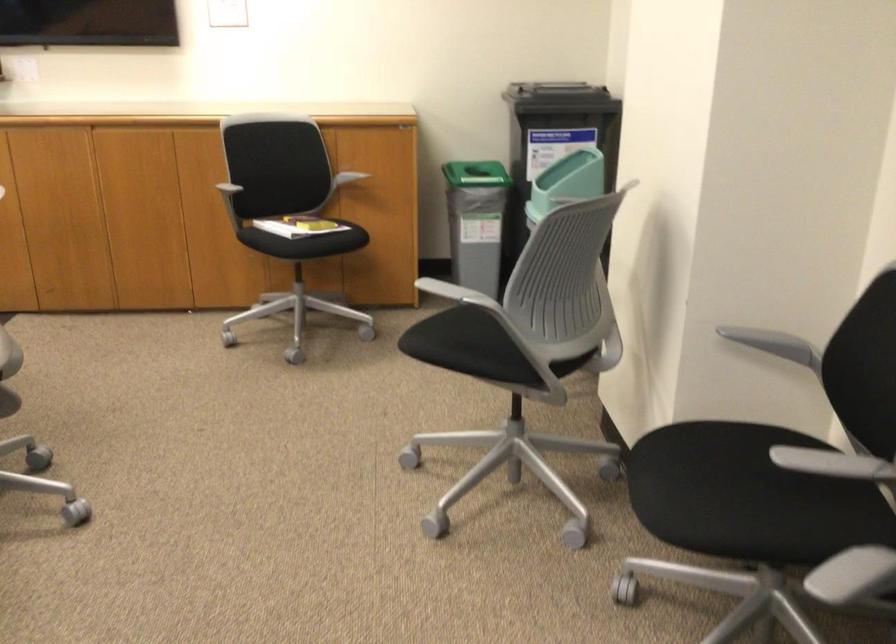
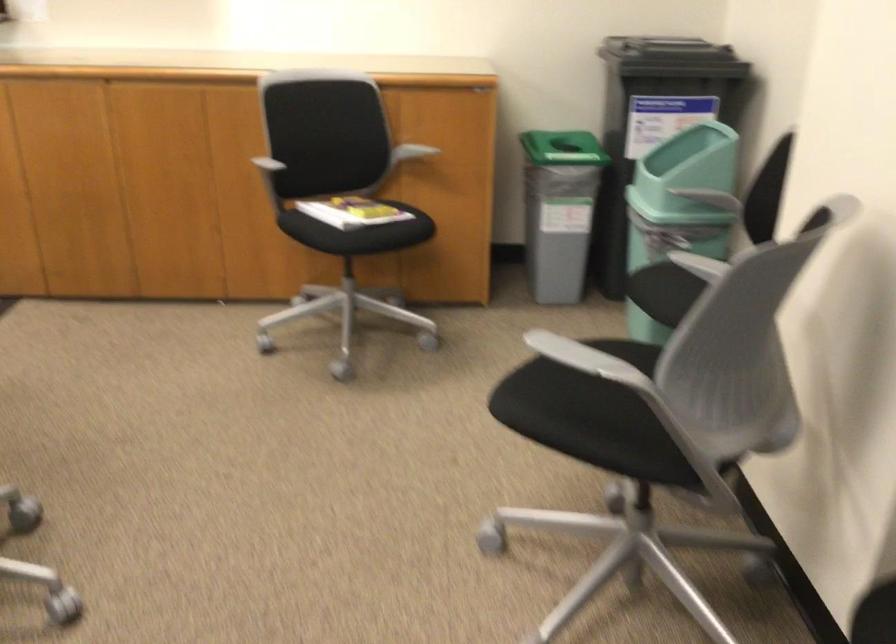
Where in the second image is the point corresponding to (x=299, y=223) from the first image?

(351, 211)